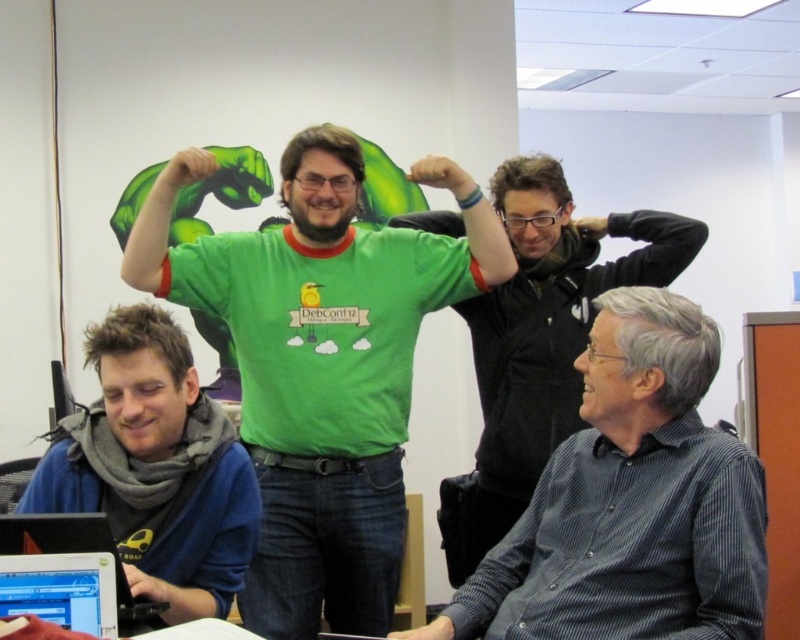
You are standing in the room and want to grab the blue fleece at lower left. Which direction should you move to reach it?

The blue fleece at lower left is located at point (156, 465), so you should move towards the lower left direction to reach it.